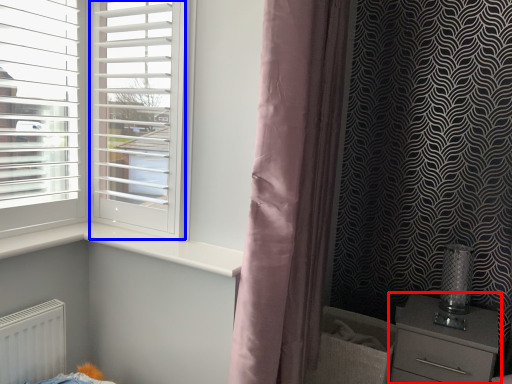
Question: Which point is further to the camera, chest of drawers (highlighted by a red box) or screen door (highlighted by a blue box)?

Choices:
 (A) chest of drawers
 (B) screen door

Answer: (A)